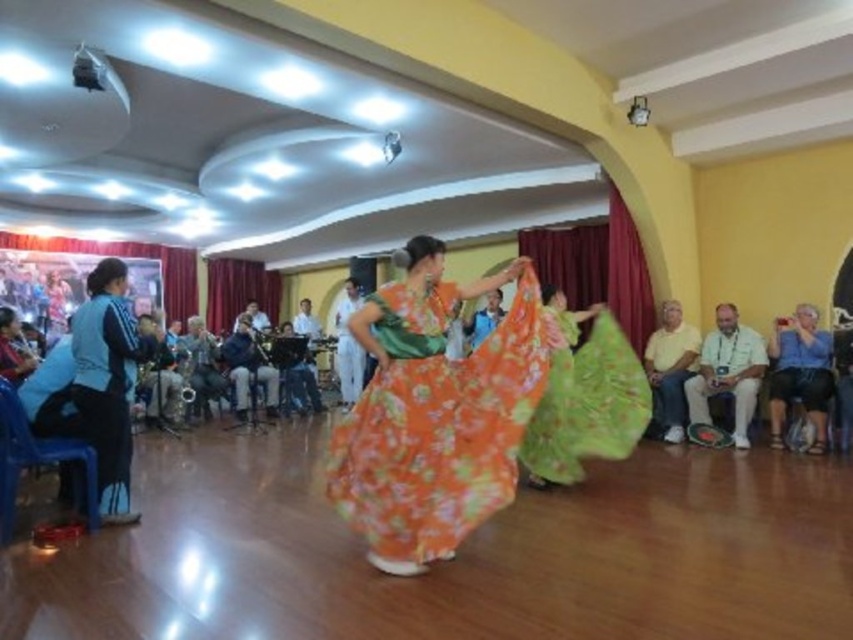
In the scene shown: You are a photographer at the dance event. You want to capture a photo of the blue fabric at center without the matte black camera at lower left blocking the view. Is the camera currently in a position that would block your shot?

The matte black camera at lower left is in front of blue fabric at center, so it would block the view of the blue fabric at center. Move the camera or adjust your angle to avoid the obstruction.

You are at a dance event and see two items at the center of the scene. Which one is more to the right, the floral cotton dress at center or the denim jacket at center?

The floral cotton dress at center is more to the right because it is positioned on the right side of the denim jacket at center.

You are a photographer at the dance event and want to capture the white fabric at right in your shot. Where should you position yourself to ensure it is visible in the frame?

You should position yourself to the right side of the scene to capture the white fabric at right, as it is located at point (728,371).